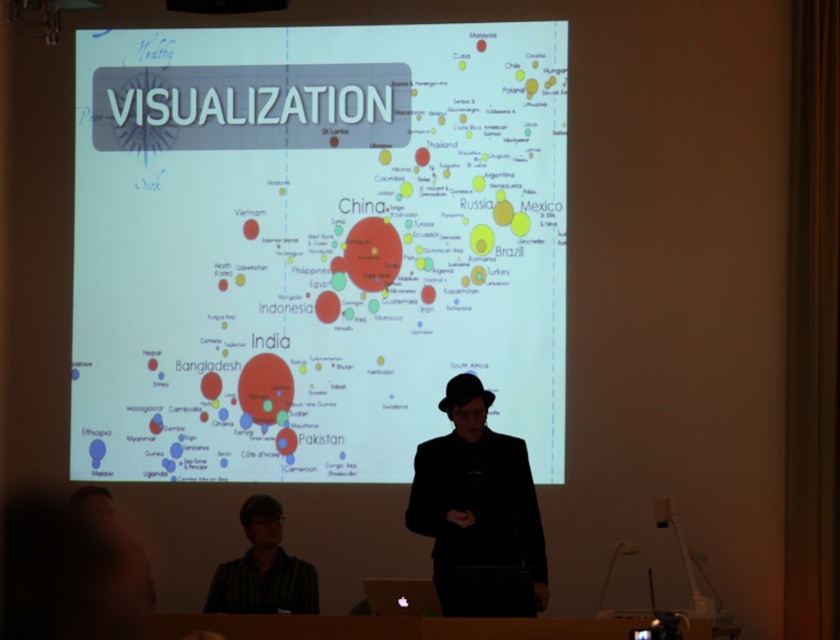
You are organizing a photo shoot and need to ensure that the black matte suit at center and the striped shirt at lower left are visible in the frame. Given their sizes, which one might require more space in the composition?

The black matte suit at center has a larger size compared to striped shirt at lower left, so it would require more space in the composition to ensure visibility.

You are attending a presentation and see the black matte suit at center and the striped shirt at lower left. Which person is taller?

The black matte suit at center is taller than the striped shirt at lower left.